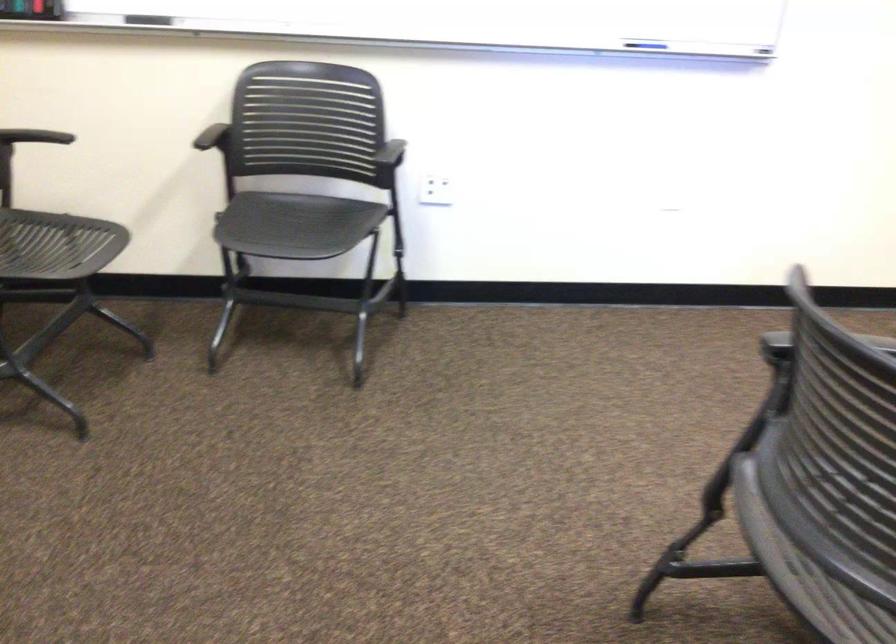
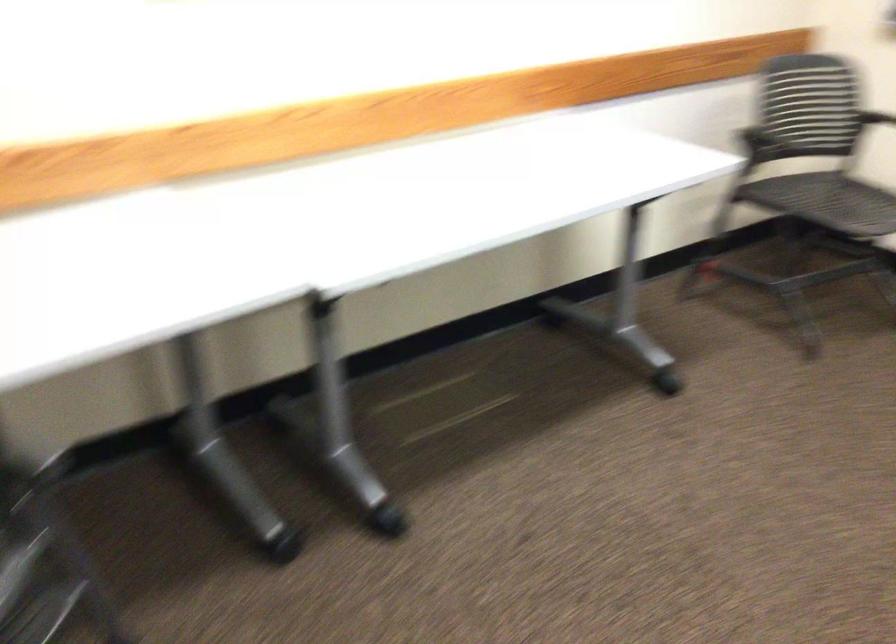
Question: The camera is either moving clockwise (left) or counter-clockwise (right) around the object. The first image is from the beginning of the video and the second image is from the end. Is the camera moving left or right when shooting the video?

Choices:
 (A) Left
 (B) Right

Answer: (B)